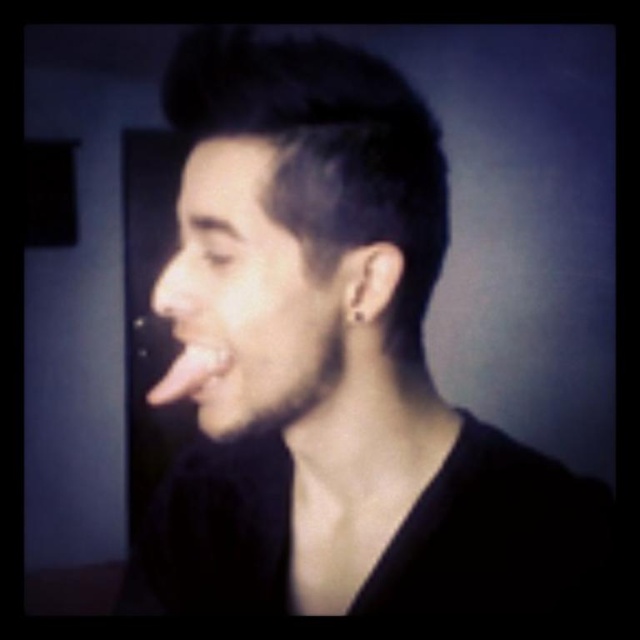
This screenshot has height=640, width=640. What do you see at coordinates (337, 365) in the screenshot?
I see `matte black shirt at center` at bounding box center [337, 365].

In the scene shown: Who is shorter, matte black shirt at center or pink flesh at center?

Standing shorter between the two is pink flesh at center.

Between point (202, 408) and point (188, 371), which one is positioned in front?

Positioned in front is point (188, 371).

Find the location of a particular element. matte black shirt at center is located at coordinates (337, 365).

Does matte black shirt at center lie in front of smooth skin face at center?

Yes, it is in front of smooth skin face at center.

Does matte black shirt at center have a lesser height compared to smooth skin face at center?

No.

Does point (198, 502) lie behind point (237, 264)?

Yes, it is behind point (237, 264).

This screenshot has height=640, width=640. What are the coordinates of `matte black shirt at center` in the screenshot? It's located at click(337, 365).

Who is more distant from viewer, (186, 365) or (180, 291)?

Point (186, 365)

Between pink flesh at center and smooth skin nose at center, which one is positioned higher?

smooth skin nose at center

Is point (193, 353) behind point (179, 301)?

Yes, point (193, 353) is behind point (179, 301).

Identify the location of pink flesh at center. (189, 372).